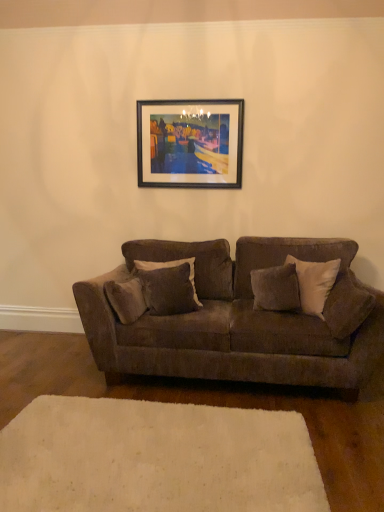
This screenshot has height=512, width=384. I want to click on empty space that is ontop of white soft rug at lower center (from a real-world perspective), so [142, 449].